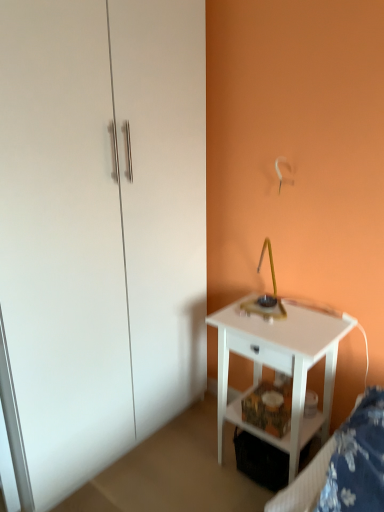
Find the location of `white glossy nightstand at lower right`. white glossy nightstand at lower right is located at coordinates (280, 365).

Describe the element at coordinates (98, 233) in the screenshot. The width and height of the screenshot is (384, 512). I see `white glossy dresser at left` at that location.

Identify the location of white fabric bed frame at lower right. Image resolution: width=384 pixels, height=512 pixels. (343, 466).

The height and width of the screenshot is (512, 384). In order to click on white glossy nightstand at lower right in this screenshot , I will do `click(280, 365)`.

Looking at their sizes, would you say white fabric bed frame at lower right is wider or thinner than white glossy dresser at left?

In the image, white fabric bed frame at lower right appears to be more narrow than white glossy dresser at left.

Is white fabric bed frame at lower right looking in the opposite direction of white glossy dresser at left?

white fabric bed frame at lower right is not turned away from white glossy dresser at left.

Is white fabric bed frame at lower right far from white glossy dresser at left?

Indeed, white fabric bed frame at lower right is not near white glossy dresser at left.

From a real-world perspective, is white fabric bed frame at lower right above or below white glossy dresser at left?

In terms of real-world spatial position, white fabric bed frame at lower right is below white glossy dresser at left.

Is white fabric bed frame at lower right oriented towards white glossy nightstand at lower right?

No, white fabric bed frame at lower right is not turned towards white glossy nightstand at lower right.

Is the position of white fabric bed frame at lower right less distant than that of white glossy nightstand at lower right?

Yes, white fabric bed frame at lower right is closer to the camera.

Can you confirm if white fabric bed frame at lower right is thinner than white glossy nightstand at lower right?

Indeed, white fabric bed frame at lower right has a lesser width compared to white glossy nightstand at lower right.

From the image's perspective, who appears lower, white fabric bed frame at lower right or white glossy nightstand at lower right?

white fabric bed frame at lower right is shown below in the image.

Is white glossy nightstand at lower right bigger than white fabric bed frame at lower right?

Yes.

Considering the sizes of white glossy nightstand at lower right and white fabric bed frame at lower right in the image, is white glossy nightstand at lower right taller or shorter than white fabric bed frame at lower right?

white glossy nightstand at lower right is taller than white fabric bed frame at lower right.

From a real-world perspective, who is located lower, white glossy nightstand at lower right or white fabric bed frame at lower right?

white glossy nightstand at lower right, from a real-world perspective.

Where is `dresser behind the white fabric bed frame at lower right`? This screenshot has width=384, height=512. dresser behind the white fabric bed frame at lower right is located at coordinates (98, 233).

In terms of height, does white glossy dresser at left look taller or shorter compared to white fabric bed frame at lower right?

In the image, white glossy dresser at left appears to be taller than white fabric bed frame at lower right.

Does white glossy dresser at left turn towards white fabric bed frame at lower right?

Yes, white glossy dresser at left is oriented towards white fabric bed frame at lower right.

Which point is more distant from viewer, (59, 197) or (314, 360)?

The point (314, 360) is farther.

From a real-world perspective, relative to white glossy nightstand at lower right, is white glossy dresser at left vertically above or below?

From a real-world perspective, white glossy dresser at left is physically above white glossy nightstand at lower right.

From the picture: What's the angular difference between white glossy dresser at left and white glossy nightstand at lower right's facing directions?

The facing directions of white glossy dresser at left and white glossy nightstand at lower right are 91.6 degrees apart.

Is white glossy nightstand at lower right positioned with its back to white glossy dresser at left?

white glossy nightstand at lower right does not have its back to white glossy dresser at left.

There is a white glossy nightstand at lower right. Where is `dresser above it (from a real-world perspective)`? This screenshot has width=384, height=512. dresser above it (from a real-world perspective) is located at coordinates (98, 233).

Does white glossy nightstand at lower right have a greater height compared to white glossy dresser at left?

Incorrect, the height of white glossy nightstand at lower right is not larger of that of white glossy dresser at left.

Where is `bed frame lying in front of the white glossy dresser at left`? This screenshot has width=384, height=512. bed frame lying in front of the white glossy dresser at left is located at coordinates (343, 466).

At what (x,y) coordinates should I click in order to perform the action: click on nightstand on the left of white fabric bed frame at lower right. Please return your answer as a coordinate pair (x, y). Image resolution: width=384 pixels, height=512 pixels. Looking at the image, I should click on (280, 365).

From the image, which object appears to be farther from white glossy nightstand at lower right, white glossy dresser at left or white fabric bed frame at lower right?

Based on the image, white glossy dresser at left appears to be further to white glossy nightstand at lower right.

When comparing their distances from white glossy nightstand at lower right, does white fabric bed frame at lower right or white glossy dresser at left seem closer?

Based on the image, white fabric bed frame at lower right appears to be nearer to white glossy nightstand at lower right.

Estimate the real-world distances between objects in this image. Which object is further from white glossy dresser at left, white fabric bed frame at lower right or white glossy nightstand at lower right?

white fabric bed frame at lower right is further to white glossy dresser at left.

Considering their positions, is white glossy dresser at left positioned closer to white fabric bed frame at lower right than white glossy nightstand at lower right?

white glossy nightstand at lower right lies closer to white fabric bed frame at lower right than the other object.

Estimate the real-world distances between objects in this image. Which object is closer to white glossy dresser at left, white glossy nightstand at lower right or white fabric bed frame at lower right?

white glossy nightstand at lower right.

When comparing their distances from white fabric bed frame at lower right, does white glossy nightstand at lower right or white glossy dresser at left seem further?

white glossy dresser at left.

Image resolution: width=384 pixels, height=512 pixels. In order to click on nightstand situated between white glossy dresser at left and white fabric bed frame at lower right from left to right in this screenshot , I will do `click(280, 365)`.